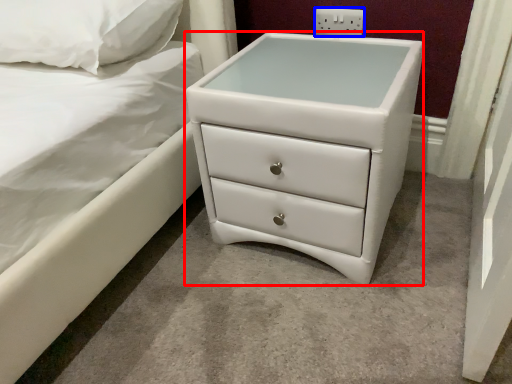
Question: Which object appears closest to the camera in this image, chest of drawers (highlighted by a red box) or electric outlet (highlighted by a blue box)?

Choices:
 (A) chest of drawers
 (B) electric outlet

Answer: (A)